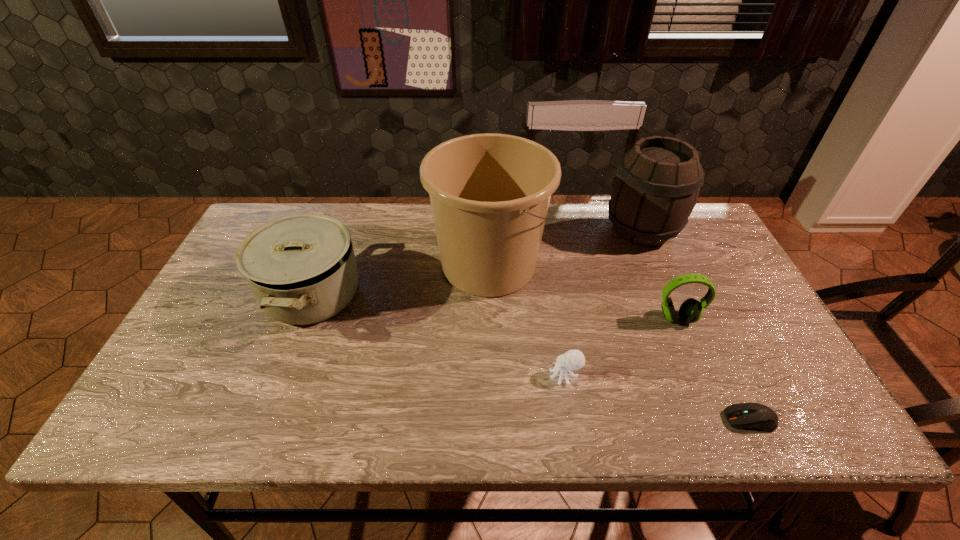
You are a GUI agent. You are given a task and a screenshot of the screen. Output one action in this format:
    pyautogui.click(x=<x>, y=<y>)
    Task: Click on the vacant area at the right edge
    The height and width of the screenshot is (540, 960).
    Given the screenshot: What is the action you would take?
    pyautogui.click(x=720, y=313)

The width and height of the screenshot is (960, 540). I want to click on free space at the near left corner, so click(x=200, y=423).

This screenshot has height=540, width=960. In order to click on free spot at the far right corner of the desktop in this screenshot , I will do `click(704, 243)`.

Locate an element on the screen. free space between the tallest object and the fourth tallest object is located at coordinates (583, 292).

Where is `vacant point located between the octopus and the wine bucket`? vacant point located between the octopus and the wine bucket is located at coordinates (603, 302).

Locate an element on the screen. vacant area that lies between the fifth tallest object and the wine bucket is located at coordinates (603, 302).

Identify the location of unoccupied area between the wine bucket and the nearest object. This screenshot has width=960, height=540. (696, 325).

Where is `free space between the fifth shortest object and the computer equipment`? This screenshot has height=540, width=960. free space between the fifth shortest object and the computer equipment is located at coordinates (696, 325).

I want to click on empty location between the headset and the wine bucket, so click(660, 274).

Where is `vacant space that's between the headset and the saucepan`? Image resolution: width=960 pixels, height=540 pixels. vacant space that's between the headset and the saucepan is located at coordinates (494, 307).